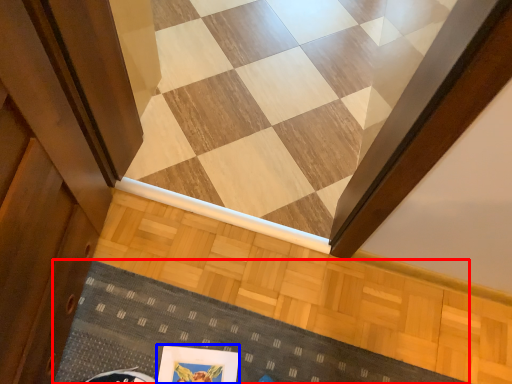
Question: Which point is further to the camera, doormat (highlighted by a red box) or picture frame (highlighted by a blue box)?

Choices:
 (A) doormat
 (B) picture frame

Answer: (A)